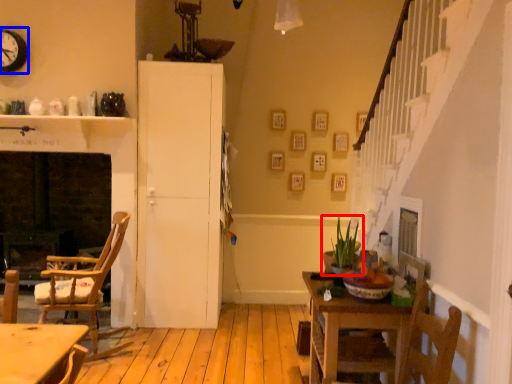
Question: Which of the following is the closest to the observer, houseplant (highlighted by a red box) or clock (highlighted by a blue box)?

Choices:
 (A) houseplant
 (B) clock

Answer: (A)